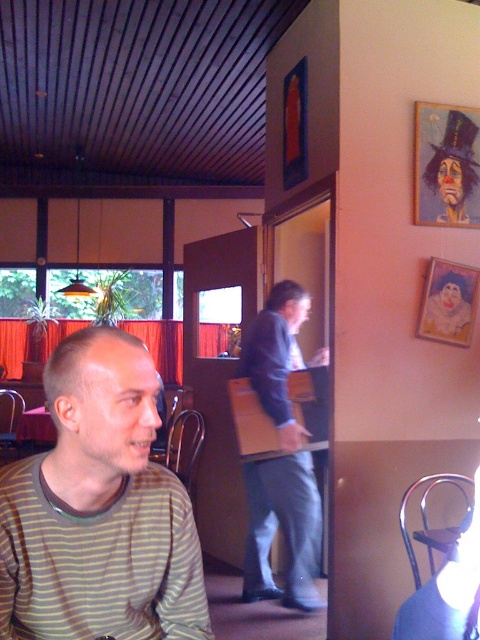
Does striped cotton shirt at center have a greater width compared to matte paper picture frame at upper right?

Correct, the width of striped cotton shirt at center exceeds that of matte paper picture frame at upper right.

Can you confirm if striped cotton shirt at center is taller than matte paper picture frame at upper right?

Indeed, striped cotton shirt at center has a greater height compared to matte paper picture frame at upper right.

This screenshot has width=480, height=640. What are the coordinates of `striped cotton shirt at center` in the screenshot? It's located at (98, 509).

Where is `striped cotton shirt at center`? This screenshot has width=480, height=640. striped cotton shirt at center is located at coordinates (98, 509).

Who is more distant from viewer, [301,296] or [437,326]?

Positioned behind is point [301,296].

Is dark blue suit at center closer to camera compared to matte paper picture frame at upper right?

Yes, dark blue suit at center is in front of matte paper picture frame at upper right.

Where is `dark blue suit at center`? dark blue suit at center is located at coordinates point(280,458).

Is wooden framed portrait at upper right behind matte paper picture frame at upper right?

No, it is in front of matte paper picture frame at upper right.

Which is above, wooden framed portrait at upper right or matte paper picture frame at upper right?

wooden framed portrait at upper right

The width and height of the screenshot is (480, 640). What do you see at coordinates (445, 164) in the screenshot? I see `wooden framed portrait at upper right` at bounding box center [445, 164].

This screenshot has width=480, height=640. I want to click on wooden framed portrait at upper right, so click(445, 164).